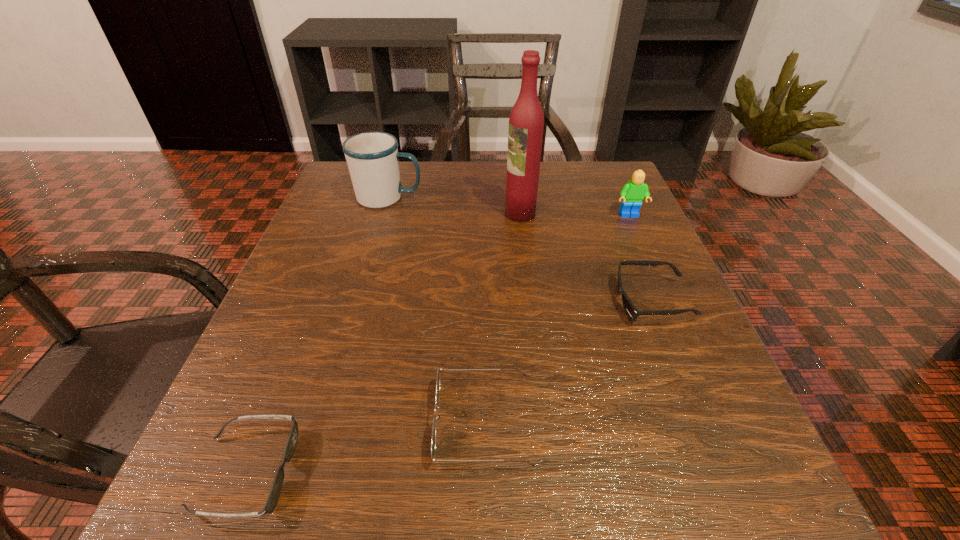
What are the coordinates of `unoccupied area between the farthest sunglasses and the second sunglasses from right to left` in the screenshot? It's located at [x=568, y=362].

This screenshot has width=960, height=540. What are the coordinates of `vacant space in between the shortest sunglasses and the liquor` in the screenshot? It's located at (383, 343).

Where is `unoccupied area between the liquor and the mug`? unoccupied area between the liquor and the mug is located at coordinates click(454, 206).

Locate an element on the screen. Image resolution: width=960 pixels, height=540 pixels. free space between the rightmost sunglasses and the tallest object is located at coordinates (586, 258).

Choose which object is the nearest neighbor to the fourth shortest object. Please provide its 2D coordinates. Your answer should be formatted as a tuple, i.e. [(x, y)], where the tuple contains the x and y coordinates of a point satisfying the conditions above.

[(526, 122)]

The height and width of the screenshot is (540, 960). Find the location of `the second closest object to the tallest object`. the second closest object to the tallest object is located at coordinates (372, 157).

Image resolution: width=960 pixels, height=540 pixels. I want to click on sunglasses that is the closest to the second sunglasses from left to right, so click(x=273, y=497).

Where is `the third closest sunglasses to the Lego`? Image resolution: width=960 pixels, height=540 pixels. the third closest sunglasses to the Lego is located at coordinates (273, 497).

At what (x,y) coordinates should I click in order to perform the action: click on vacant space that satisfies the following two spatial constraints: 1. on the face of the Lego; 2. on the front-facing side of the rightmost sunglasses. Please return your answer as a coordinate pair (x, y). The image size is (960, 540). Looking at the image, I should click on (667, 302).